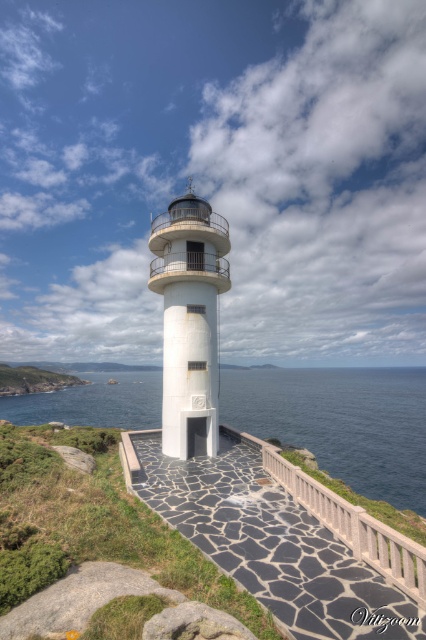
You are a maintenance worker needing to reach the top of the white smooth lighthouse at center. You are currently standing on the black stone path at center. Which direction should you move to ascend towards the lighthouse?

To ascend towards the white smooth lighthouse at center, you should move towards it since the lighthouse has a greater height than the black stone path at center.

You are a tour guide leading a group to the lighthouse. You need to ensure visitors stay at least 150 feet away from the edge of the cliff for safety. The black stone path at center leads towards the blue water at center. Is the current path safe for visitors?

The distance between the black stone path at center and the blue water at center is 151.75 feet, which exceeds the required 150 feet safety distance. Therefore, the path is safe for visitors.

You are standing on the cliff edge looking at the scene. Which object, the blue water at center or the white smooth lighthouse at center, is closer to you?

The blue water at center is closer to you because it is further to the viewer than the white smooth lighthouse at center, meaning it appears nearer in the visual perspective.